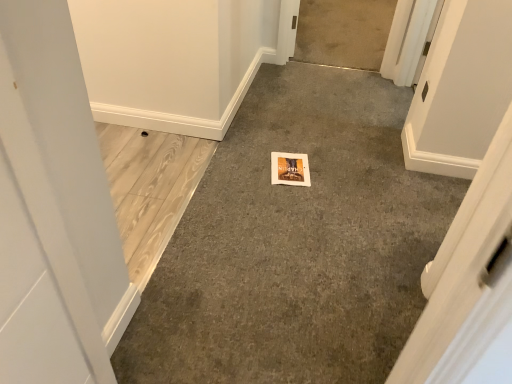
Question: Is gray carpet at center, marked as the first concrete in a front-to-back arrangement, positioned with its back to gray carpet at center, which is counted as the 1th concrete, starting from the back?

Choices:
 (A) yes
 (B) no

Answer: (A)

Question: Can you confirm if gray carpet at center, marked as the first concrete in a front-to-back arrangement, is thinner than gray carpet at center, the third concrete positioned from the front?

Choices:
 (A) yes
 (B) no

Answer: (B)

Question: Considering the relative sizes of gray carpet at center, which is counted as the third concrete, starting from the back, and gray carpet at center, the third concrete positioned from the front, in the image provided, is gray carpet at center, which is counted as the third concrete, starting from the back, bigger than gray carpet at center, the third concrete positioned from the front,?

Choices:
 (A) no
 (B) yes

Answer: (B)

Question: Is gray carpet at center, which is counted as the third concrete, starting from the back, oriented towards gray carpet at center, the third concrete positioned from the front?

Choices:
 (A) no
 (B) yes

Answer: (A)

Question: Is gray carpet at center, marked as the first concrete in a front-to-back arrangement, positioned far away from gray carpet at center, the third concrete positioned from the front?

Choices:
 (A) yes
 (B) no

Answer: (A)

Question: From a real-world perspective, relative to light brown wood flooring at left, the 2th concrete viewed from the front, is gray carpet at center, marked as the first concrete in a front-to-back arrangement, vertically above or below?

Choices:
 (A) above
 (B) below

Answer: (A)

Question: From their relative heights in the image, would you say gray carpet at center, which is counted as the third concrete, starting from the back, is taller or shorter than light brown wood flooring at left, the 2th concrete viewed from the front?

Choices:
 (A) tall
 (B) short

Answer: (A)

Question: Does point (265, 115) appear closer or farther from the camera than point (141, 200)?

Choices:
 (A) farther
 (B) closer

Answer: (A)

Question: Do you think gray carpet at center, which is counted as the third concrete, starting from the back, is within light brown wood flooring at left, the 2th concrete viewed from the front, or outside of it?

Choices:
 (A) outside
 (B) inside

Answer: (A)

Question: Which is correct: gray carpet at center, which is counted as the third concrete, starting from the back, is inside gray carpet at center, the third concrete positioned from the front, or outside of it?

Choices:
 (A) inside
 (B) outside

Answer: (B)

Question: Looking at the image, does gray carpet at center, marked as the first concrete in a front-to-back arrangement, seem bigger or smaller compared to gray carpet at center, which is counted as the 1th concrete, starting from the back?

Choices:
 (A) small
 (B) big

Answer: (B)

Question: In the image, is gray carpet at center, marked as the first concrete in a front-to-back arrangement, positioned in front of or behind gray carpet at center, which is counted as the 1th concrete, starting from the back?

Choices:
 (A) front
 (B) behind

Answer: (A)

Question: From a real-world perspective, is gray carpet at center, which is counted as the third concrete, starting from the back, positioned above or below gray carpet at center, the third concrete positioned from the front?

Choices:
 (A) above
 (B) below

Answer: (A)

Question: Is point (167, 200) closer or farther from the camera than point (355, 26)?

Choices:
 (A) farther
 (B) closer

Answer: (B)

Question: From their relative heights in the image, would you say light brown wood flooring at left, which is the 2th concrete in back-to-front order, is taller or shorter than gray carpet at center, the third concrete positioned from the front?

Choices:
 (A) short
 (B) tall

Answer: (A)